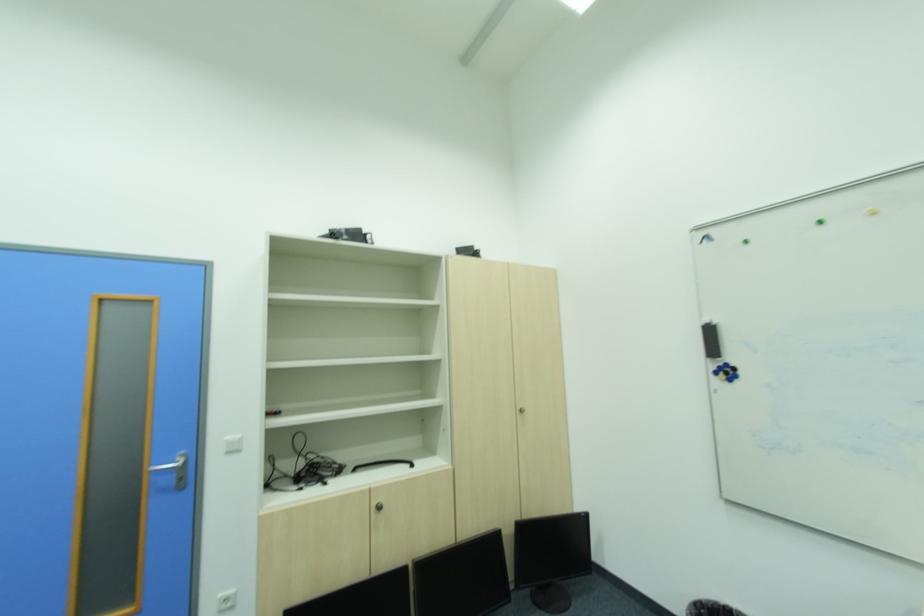
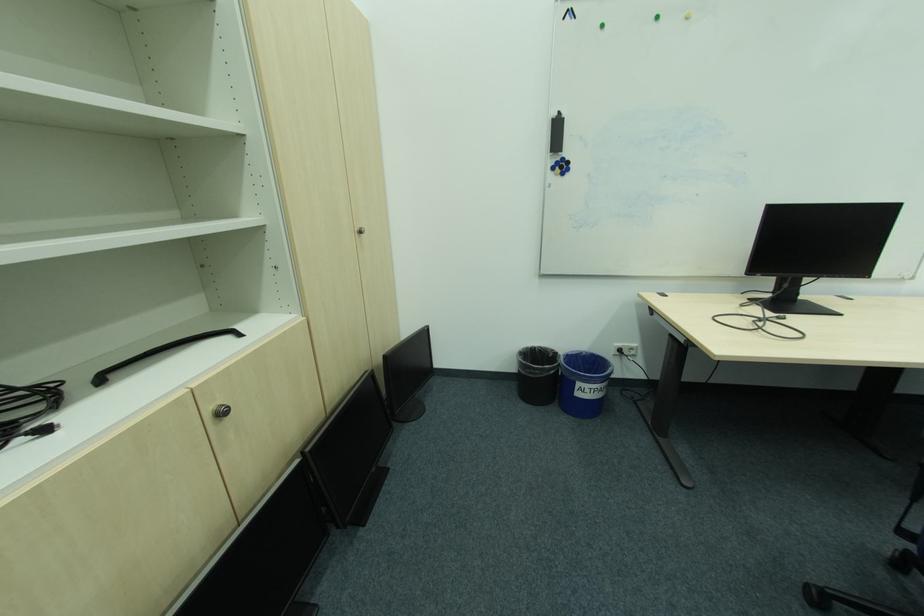
The point at (386, 509) is marked in the first image. Where is the corresponding point in the second image?

(227, 415)